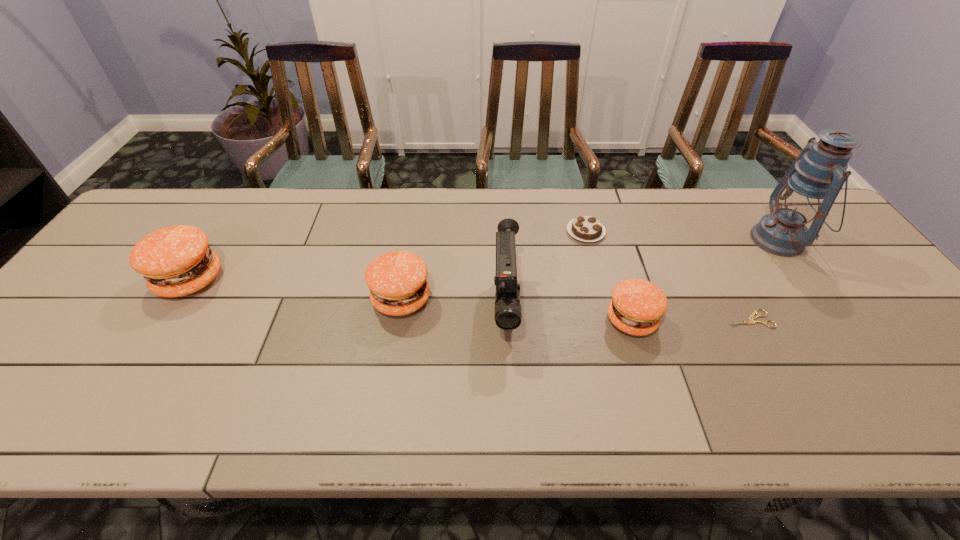
All pattys are currently evenly spaced. To continue this pattern, where would you add another patty on the right? Please point out a vacant spot. Please provide its 2D coordinates. Your answer should be formatted as a tuple, i.e. [(x, y)], where the tuple contains the x and y coordinates of a point satisfying the conditions above.

[(883, 343)]